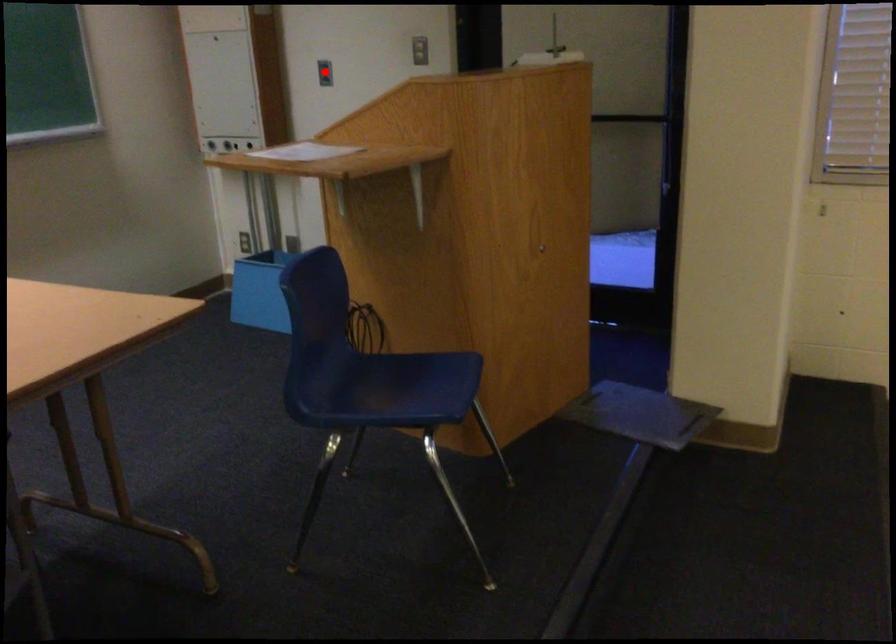
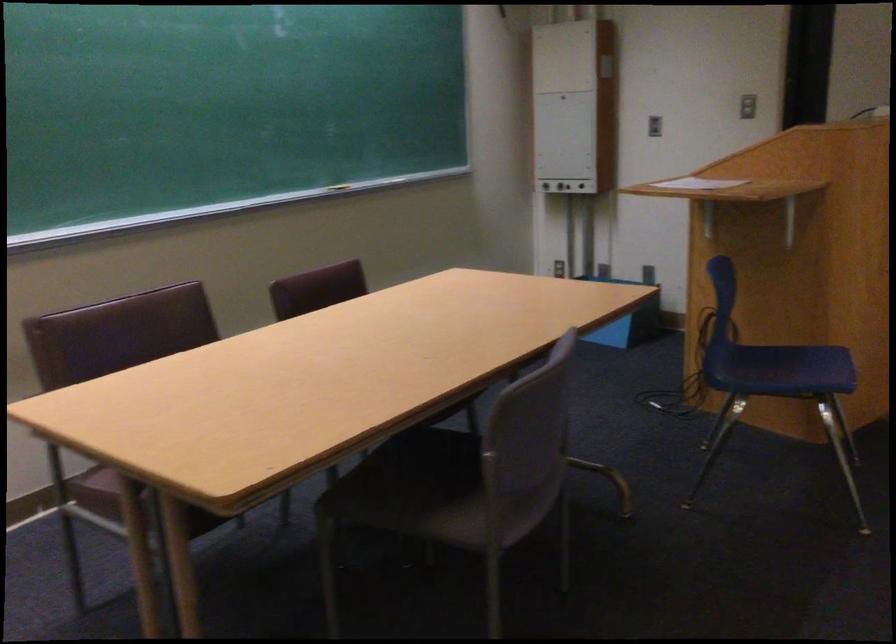
In the second image, find the point that corresponds to the highlighted location in the first image.

(653, 126)